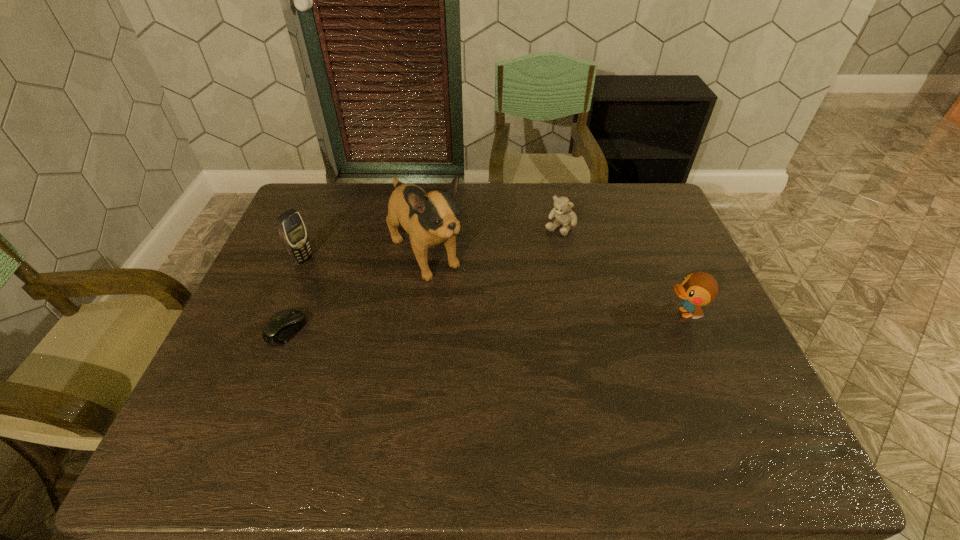
This screenshot has width=960, height=540. I want to click on free space on the desktop that is between the mouse and the third tallest object and is positioned on the front face of the cellular telephone, so click(437, 323).

What are the coordinates of `free space on the desktop that is between the shortest object and the duck and is positioned at the face of the tallest object` in the screenshot? It's located at (483, 322).

The width and height of the screenshot is (960, 540). Find the location of `free space on the desktop that is between the mouse and the rightmost object and is positioned on the face of the teddy bear`. free space on the desktop that is between the mouse and the rightmost object and is positioned on the face of the teddy bear is located at coordinates (485, 322).